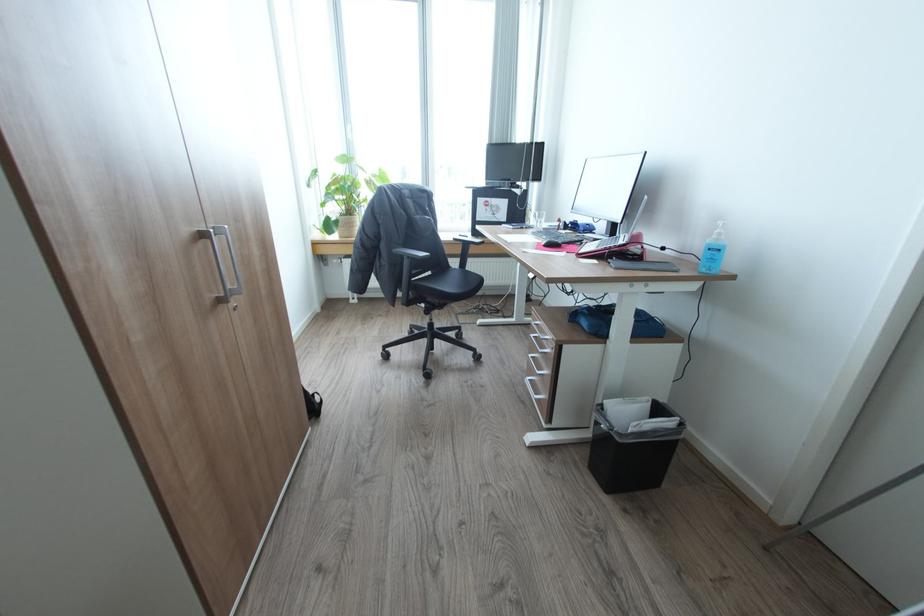
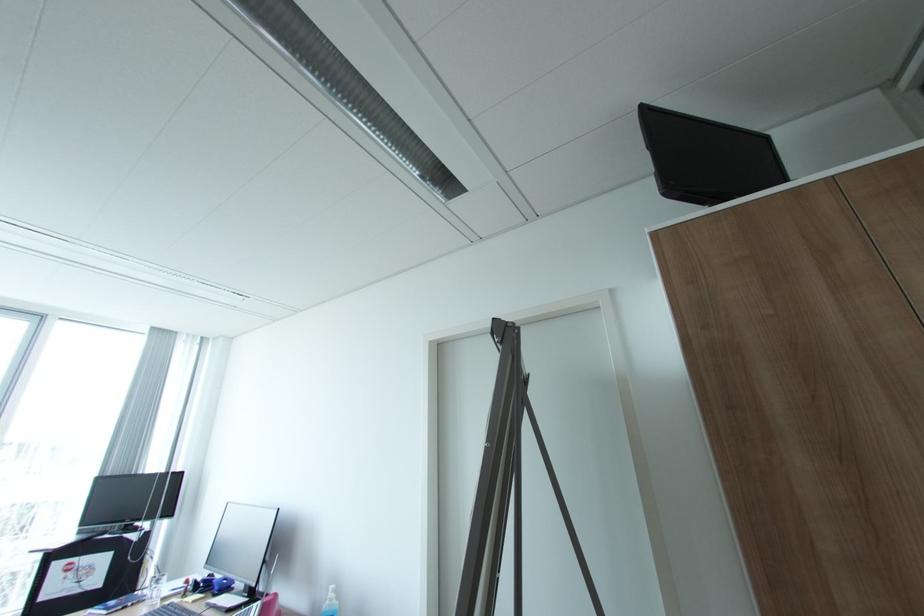
Find the pixel in the second image that matches the point at 723,233 in the first image.

(336, 599)